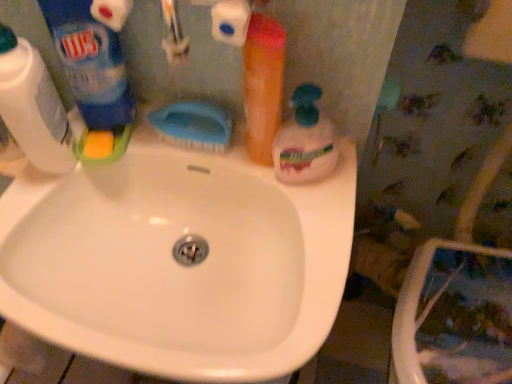
The height and width of the screenshot is (384, 512). What do you see at coordinates (263, 85) in the screenshot?
I see `translucent orange bottle at upper right, the second cleaning product in the right-to-left sequence` at bounding box center [263, 85].

This screenshot has height=384, width=512. Identify the location of blue plastic brush at center. (193, 125).

Is translucent plastic soap dispenser at center, acting as the 4th cleaning product starting from the left, facing away from blue plastic brush at center?

translucent plastic soap dispenser at center, acting as the 4th cleaning product starting from the left, does not have its back to blue plastic brush at center.

From a real-world perspective, relative to blue plastic brush at center, is translucent plastic soap dispenser at center, acting as the 4th cleaning product starting from the left, vertically above or below?

In terms of real-world spatial position, translucent plastic soap dispenser at center, acting as the 4th cleaning product starting from the left, is above blue plastic brush at center.

Between translucent plastic soap dispenser at center, acting as the 4th cleaning product starting from the left, and blue plastic brush at center, which one appears on the left side from the viewer's perspective?

blue plastic brush at center.

Consider the image. From a real-world perspective, is blue plastic bottle at upper left, the 2th cleaning product in the left-to-right sequence, positioned under white glossy sink at center based on gravity?

No.

Could you tell me if blue plastic bottle at upper left, the 2th cleaning product in the left-to-right sequence, is facing white glossy sink at center?

No, blue plastic bottle at upper left, the 2th cleaning product in the left-to-right sequence, is not facing towards white glossy sink at center.

Considering the relative sizes of blue plastic bottle at upper left, the 3th cleaning product in the right-to-left sequence, and translucent orange bottle at upper right, marked as the 3th cleaning product in a left-to-right arrangement, in the image provided, is blue plastic bottle at upper left, the 3th cleaning product in the right-to-left sequence, shorter than translucent orange bottle at upper right, marked as the 3th cleaning product in a left-to-right arrangement,?

In fact, blue plastic bottle at upper left, the 3th cleaning product in the right-to-left sequence, may be taller than translucent orange bottle at upper right, marked as the 3th cleaning product in a left-to-right arrangement.

Looking at this image, based on their positions, is blue plastic bottle at upper left, the 3th cleaning product in the right-to-left sequence, located to the left or right of translucent orange bottle at upper right, marked as the 3th cleaning product in a left-to-right arrangement?

In the image, blue plastic bottle at upper left, the 3th cleaning product in the right-to-left sequence, appears on the left side of translucent orange bottle at upper right, marked as the 3th cleaning product in a left-to-right arrangement.

Considering the positions of points (110, 19) and (276, 85), is point (110, 19) farther from camera compared to point (276, 85)?

Yes, point (110, 19) is behind point (276, 85).

Is blue plastic bottle at upper left, the 2th cleaning product in the left-to-right sequence, located outside translucent orange bottle at upper right, marked as the 3th cleaning product in a left-to-right arrangement?

Yes, blue plastic bottle at upper left, the 2th cleaning product in the left-to-right sequence, is outside of translucent orange bottle at upper right, marked as the 3th cleaning product in a left-to-right arrangement.

Is white plastic bottle at left, positioned as the 4th cleaning product in right-to-left order, located outside translucent plastic soap dispenser at center, acting as the 4th cleaning product starting from the left?

Yes.

Considering the relative positions of white plastic bottle at left, which is the first cleaning product in left-to-right order, and translucent plastic soap dispenser at center, acting as the 4th cleaning product starting from the left, in the image provided, is white plastic bottle at left, which is the first cleaning product in left-to-right order, behind translucent plastic soap dispenser at center, acting as the 4th cleaning product starting from the left,?

No.

Can you confirm if white plastic bottle at left, which is the first cleaning product in left-to-right order, is positioned to the right of translucent plastic soap dispenser at center, acting as the 4th cleaning product starting from the left?

No, white plastic bottle at left, which is the first cleaning product in left-to-right order, is not to the right of translucent plastic soap dispenser at center, acting as the 4th cleaning product starting from the left.

Which is correct: blue plastic bottle at upper left, the 3th cleaning product in the right-to-left sequence, is inside blue plastic brush at center, or outside of it?

blue plastic bottle at upper left, the 3th cleaning product in the right-to-left sequence, is not enclosed by blue plastic brush at center.

Between blue plastic bottle at upper left, the 2th cleaning product in the left-to-right sequence, and blue plastic brush at center, which one appears on the right side from the viewer's perspective?

blue plastic brush at center is more to the right.

Which point is more forward, (83, 88) or (174, 137)?

Positioned in front is point (83, 88).

Considering the relative positions of white glossy sink at center and translucent orange bottle at upper right, the second cleaning product in the right-to-left sequence, in the image provided, is white glossy sink at center to the left of translucent orange bottle at upper right, the second cleaning product in the right-to-left sequence, from the viewer's perspective?

Correct, you'll find white glossy sink at center to the left of translucent orange bottle at upper right, the second cleaning product in the right-to-left sequence.

Could you tell me if white glossy sink at center is turned towards translucent orange bottle at upper right, marked as the 3th cleaning product in a left-to-right arrangement?

No, white glossy sink at center is not aimed at translucent orange bottle at upper right, marked as the 3th cleaning product in a left-to-right arrangement.

Consider the image. Is white glossy sink at center beside translucent orange bottle at upper right, the second cleaning product in the right-to-left sequence?

No.

Which is behind, point (161, 246) or point (276, 109)?

The point (161, 246) is behind.

Is blue plastic bottle at upper left, the 2th cleaning product in the left-to-right sequence, situated inside translucent plastic soap dispenser at center, which is the first cleaning product in right-to-left order, or outside?

The correct answer is: outside.

From a real-world perspective, which object rests below the other?

translucent plastic soap dispenser at center, which is the first cleaning product in right-to-left order, is physically lower.

Identify the location of the 2nd cleaning product in front of the translucent plastic soap dispenser at center, acting as the 4th cleaning product starting from the left. The width and height of the screenshot is (512, 384). (91, 62).

Locate an element on the screen. This screenshot has height=384, width=512. cleaning product below the blue plastic brush at center (from the image's perspective) is located at coordinates (305, 141).

Locate an element on the screen. This screenshot has width=512, height=384. sink that is under the blue plastic bottle at upper left, the 2th cleaning product in the left-to-right sequence (from a real-world perspective) is located at coordinates (177, 263).

From the image, which object appears to be nearer to blue plastic brush at center, white plastic bottle at left, positioned as the 4th cleaning product in right-to-left order, or blue plastic bottle at upper left, the 3th cleaning product in the right-to-left sequence?

blue plastic bottle at upper left, the 3th cleaning product in the right-to-left sequence, lies closer to blue plastic brush at center than the other object.

From the image, which object appears to be nearer to blue plastic brush at center, translucent plastic soap dispenser at center, which is the first cleaning product in right-to-left order, or white glossy sink at center?

Based on the image, translucent plastic soap dispenser at center, which is the first cleaning product in right-to-left order, appears to be nearer to blue plastic brush at center.

From the image, which object appears to be nearer to translucent orange bottle at upper right, the second cleaning product in the right-to-left sequence, blue plastic brush at center or translucent plastic soap dispenser at center, acting as the 4th cleaning product starting from the left?

translucent plastic soap dispenser at center, acting as the 4th cleaning product starting from the left.

Looking at the image, which one is located further to white plastic bottle at left, positioned as the 4th cleaning product in right-to-left order, blue plastic brush at center or blue plastic bottle at upper left, the 3th cleaning product in the right-to-left sequence?

Based on the image, blue plastic brush at center appears to be further to white plastic bottle at left, positioned as the 4th cleaning product in right-to-left order.

Estimate the real-world distances between objects in this image. Which object is further from blue plastic bottle at upper left, the 2th cleaning product in the left-to-right sequence, translucent plastic soap dispenser at center, acting as the 4th cleaning product starting from the left, or blue plastic brush at center?

Among the two, translucent plastic soap dispenser at center, acting as the 4th cleaning product starting from the left, is located further to blue plastic bottle at upper left, the 2th cleaning product in the left-to-right sequence.

Based on their spatial positions, is translucent plastic soap dispenser at center, which is the first cleaning product in right-to-left order, or blue plastic bottle at upper left, the 3th cleaning product in the right-to-left sequence, closer to blue plastic brush at center?

blue plastic bottle at upper left, the 3th cleaning product in the right-to-left sequence.

Looking at the image, which one is located further to translucent orange bottle at upper right, the second cleaning product in the right-to-left sequence, translucent plastic soap dispenser at center, which is the first cleaning product in right-to-left order, or white glossy sink at center?

white glossy sink at center is positioned further to the anchor translucent orange bottle at upper right, the second cleaning product in the right-to-left sequence.

When comparing their distances from blue plastic brush at center, does translucent orange bottle at upper right, marked as the 3th cleaning product in a left-to-right arrangement, or blue plastic bottle at upper left, the 3th cleaning product in the right-to-left sequence, seem closer?

translucent orange bottle at upper right, marked as the 3th cleaning product in a left-to-right arrangement, is positioned closer to the anchor blue plastic brush at center.

At what (x,y) coordinates should I click in order to perform the action: click on brush between white plastic bottle at left, which is the first cleaning product in left-to-right order, and white glossy sink at center vertically. Please return your answer as a coordinate pair (x, y). This screenshot has height=384, width=512. Looking at the image, I should click on (193, 125).

Where is `brush located between blue plastic bottle at upper left, the 2th cleaning product in the left-to-right sequence, and translucent orange bottle at upper right, marked as the 3th cleaning product in a left-to-right arrangement, in the left-right direction`? brush located between blue plastic bottle at upper left, the 2th cleaning product in the left-to-right sequence, and translucent orange bottle at upper right, marked as the 3th cleaning product in a left-to-right arrangement, in the left-right direction is located at coordinates (193, 125).

The image size is (512, 384). Find the location of `cleaning product between blue plastic brush at center and white glossy sink at center in the up-down direction`. cleaning product between blue plastic brush at center and white glossy sink at center in the up-down direction is located at coordinates (305, 141).

Find the location of a particular element. cleaning product between translucent orange bottle at upper right, marked as the 3th cleaning product in a left-to-right arrangement, and white glossy sink at center vertically is located at coordinates 305,141.